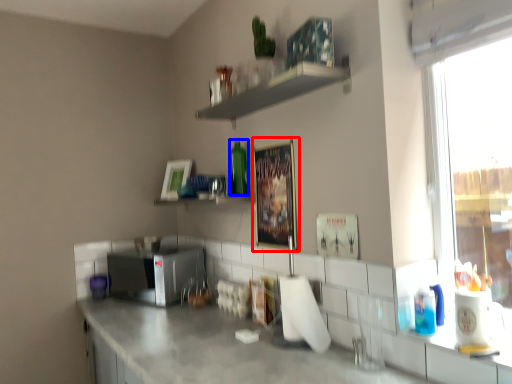
Question: Which point is further to the camera, picture frame (highlighted by a red box) or bottle (highlighted by a blue box)?

Choices:
 (A) picture frame
 (B) bottle

Answer: (B)